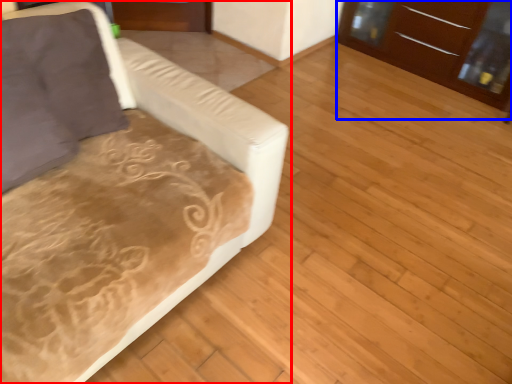
Question: Which object is closer to the camera taking this photo, studio couch (highlighted by a red box) or dresser (highlighted by a blue box)?

Choices:
 (A) studio couch
 (B) dresser

Answer: (A)